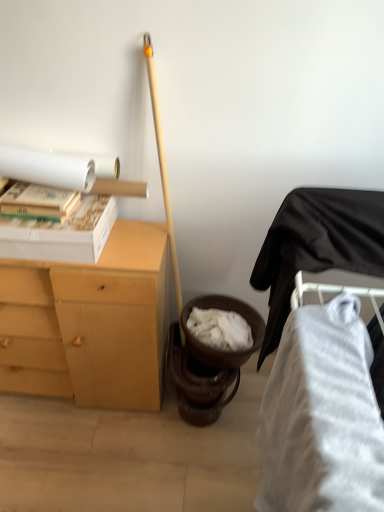
Identify the location of empty space that is ontop of white matte book at upper left (from a real-world perspective). (44, 193).